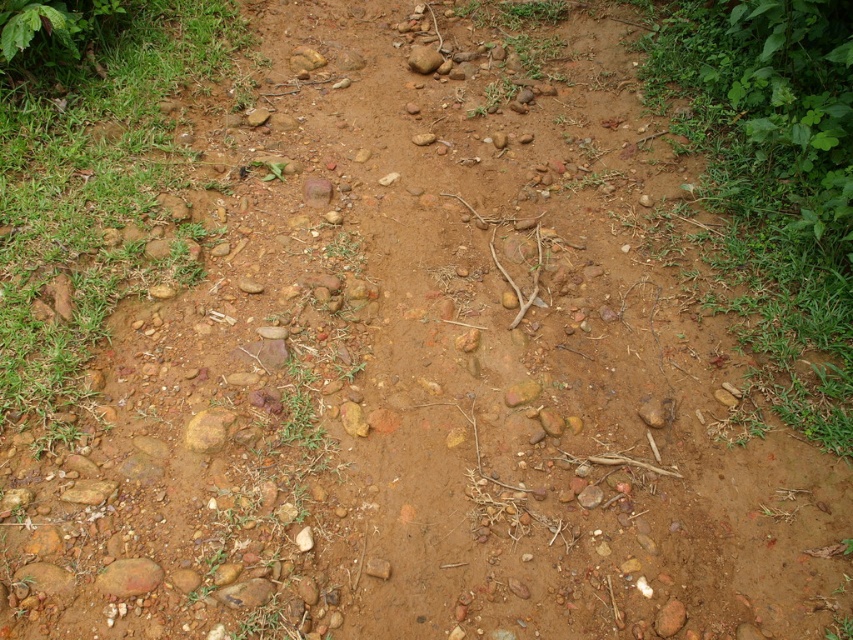
You are standing at the origin point of the coordinate system. You want to walk to the green grass at left. Which direction should you move in?

The green grass at left is located at coordinate point 0.312 on the x axis and 0.117 on the y axis. Since you are at the origin, you should move in the positive x and positive y direction to reach the green grass at left.

You are a hiker carrying a backpack and need to step over two obstacles on the path. You see the brown rough rock at lower left and the yellow rough stone at center. Which one should you avoid stepping on if you want to choose the larger obstacle to step over?

You should step over the yellow rough stone at center because it is larger than the brown rough rock at lower left.

You are a hiker carrying a backpack with limited space. You come across the brown rough rock at lower left and the yellow rough stone at center. Which one can you fit better into your backpack based on their sizes?

The yellow rough stone at center is narrower than the brown rough rock at lower left, so it can fit better into your backpack.